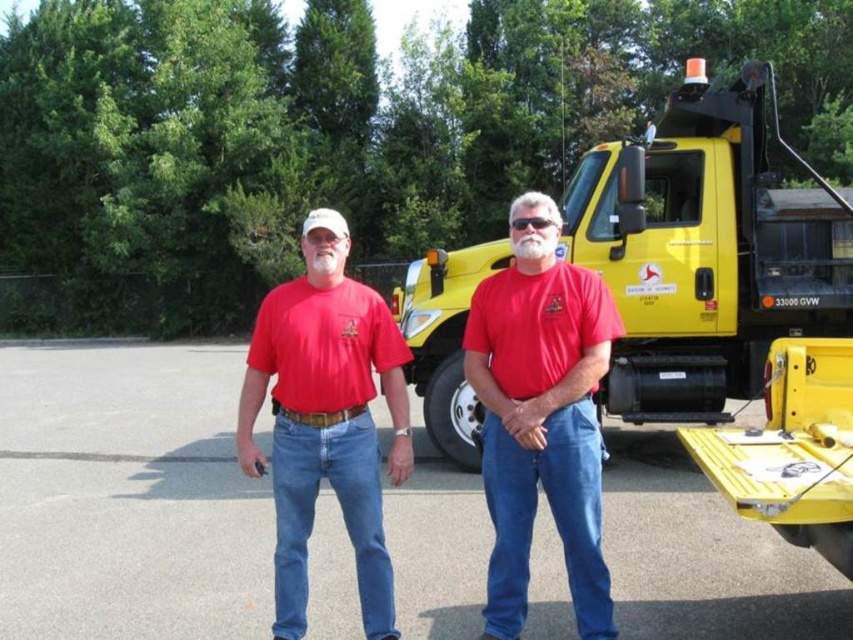
Looking at this image, does matte red shirt at center appear on the right side of matte red t-shirt at center?

Indeed, matte red shirt at center is positioned on the right side of matte red t-shirt at center.

Does matte red shirt at center appear over matte red t-shirt at center?

Incorrect, matte red shirt at center is not positioned above matte red t-shirt at center.

What do you see at coordinates (541, 416) in the screenshot?
I see `matte red shirt at center` at bounding box center [541, 416].

You are a GUI agent. You are given a task and a screenshot of the screen. Output one action in this format:
    pyautogui.click(x=<x>, y=<y>)
    Task: Click on the matte red shirt at center
    Image resolution: width=853 pixels, height=640 pixels.
    Given the screenshot: What is the action you would take?
    pyautogui.click(x=541, y=416)

Is yellow matte tow truck at right further to the viewer compared to matte red t-shirt at center?

Yes, it is.

Between yellow matte tow truck at right and matte red t-shirt at center, which one has more height?

yellow matte tow truck at right is taller.

Describe the element at coordinates (706, 250) in the screenshot. This screenshot has width=853, height=640. I see `yellow matte tow truck at right` at that location.

Where is `yellow matte tow truck at right`? This screenshot has height=640, width=853. yellow matte tow truck at right is located at coordinates (706, 250).

Can you confirm if yellow matte tow truck at right is positioned above red cotton shirt at center?

Yes, yellow matte tow truck at right is above red cotton shirt at center.

Who is more distant from viewer, (749, 104) or (367, 356)?

Positioned behind is point (749, 104).

Measure the distance between yellow matte tow truck at right and camera.

20.99 feet

This screenshot has width=853, height=640. Identify the location of yellow matte tow truck at right. (706, 250).